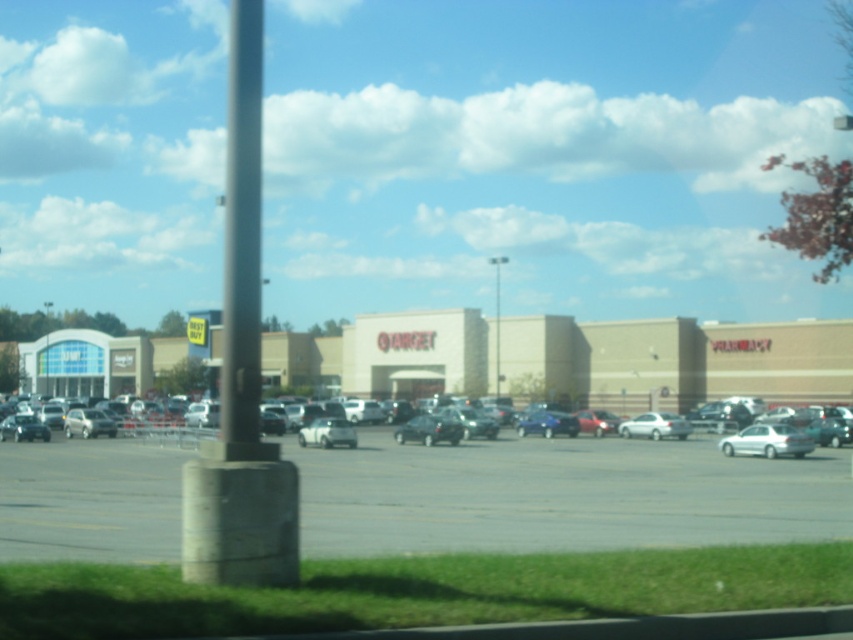
Is point (782, 428) behind point (459, 424)?

That is False.

Consider the image. Who is positioned more to the right, white glossy sedan at center or shiny black sedan at center?

From the viewer's perspective, white glossy sedan at center appears more on the right side.

Does point (740, 435) come behind point (419, 435)?

No.

Where is `white glossy sedan at center`? white glossy sedan at center is located at coordinates pyautogui.click(x=767, y=442).

This screenshot has height=640, width=853. What do you see at coordinates (428, 429) in the screenshot?
I see `shiny black sedan at center` at bounding box center [428, 429].

Who is positioned more to the right, shiny black sedan at center or shiny silver sedan at left?

From the viewer's perspective, shiny black sedan at center appears more on the right side.

What are the coordinates of `shiny black sedan at center` in the screenshot? It's located at (428, 429).

Can you confirm if gray asphalt parking lot at center is positioned to the right of silver metallic sedan at lower center?

Correct, you'll find gray asphalt parking lot at center to the right of silver metallic sedan at lower center.

You are a GUI agent. You are given a task and a screenshot of the screen. Output one action in this format:
    pyautogui.click(x=<x>, y=<y>)
    Task: Click on the gray asphalt parking lot at center
    The height and width of the screenshot is (640, 853).
    Given the screenshot: What is the action you would take?
    pyautogui.click(x=560, y=496)